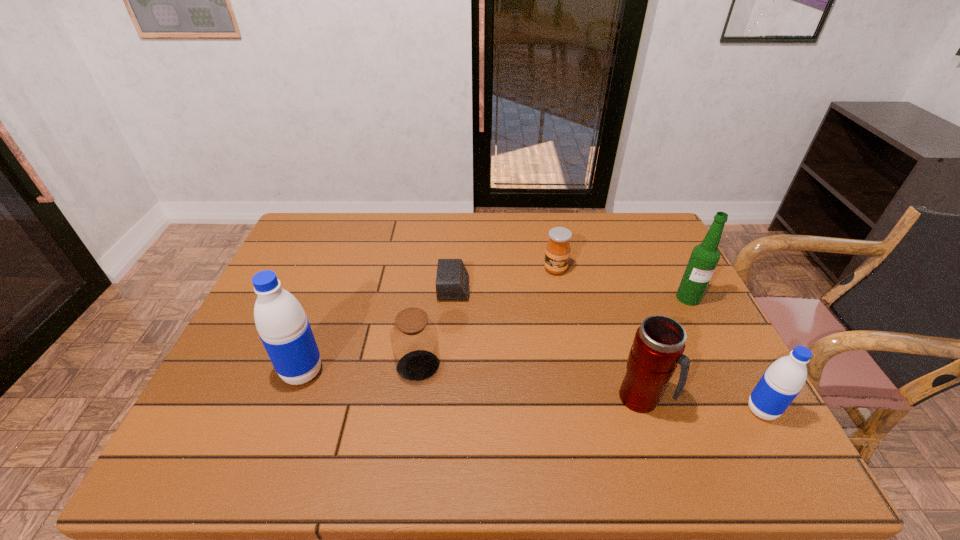
To make them evenly spaced by inserting another water_bottle among them, please locate a free space for this new water_bottle. Please provide its 2D coordinates. Your answer should be formatted as a tuple, i.e. [(x, y)], where the tuple contains the x and y coordinates of a point satisfying the conditions above.

[(523, 390)]